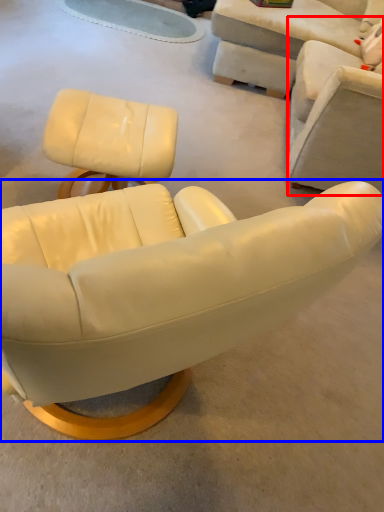
Question: Which object appears closest to the camera in this image, chair (highlighted by a red box) or chair (highlighted by a blue box)?

Choices:
 (A) chair
 (B) chair

Answer: (B)